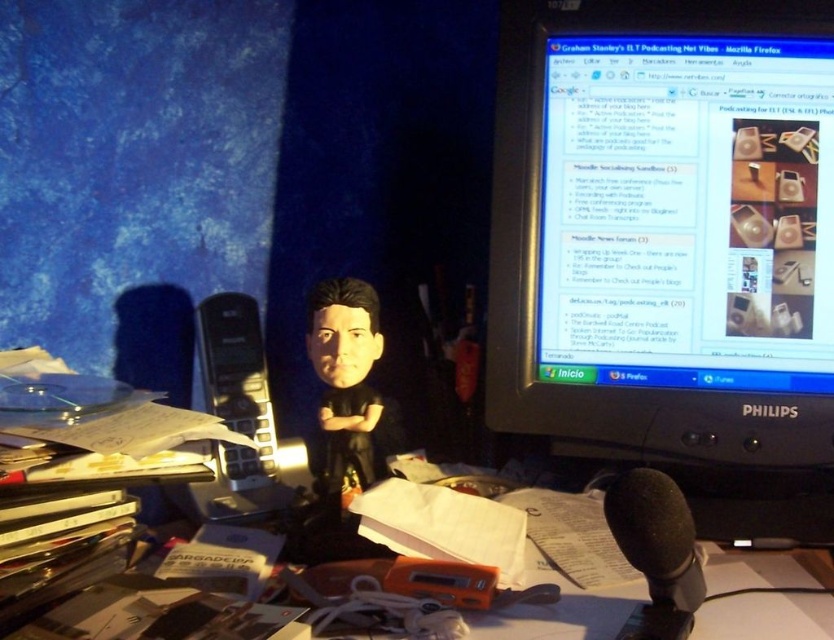
Question: Which of the following is the closest to the observer?

Choices:
 (A) matte black microphone at center
 (B) black matte microphone at center
 (C) black plastic monitor at upper right

Answer: (A)

Question: Which point is farther from the camera taking this photo?

Choices:
 (A) (701, 145)
 (B) (672, 582)
 (C) (198, 611)

Answer: (A)

Question: Which point appears closest to the camera in this image?

Choices:
 (A) (161, 609)
 (B) (637, 467)
 (C) (829, 182)

Answer: (A)

Question: Does matte black microphone at center have a smaller size compared to black matte microphone at center?

Choices:
 (A) yes
 (B) no

Answer: (B)

Question: Is black plastic monitor at upper right in front of matte black microphone at center?

Choices:
 (A) no
 (B) yes

Answer: (A)

Question: Is the position of matte black microphone at center less distant than that of black matte microphone at center?

Choices:
 (A) no
 (B) yes

Answer: (B)